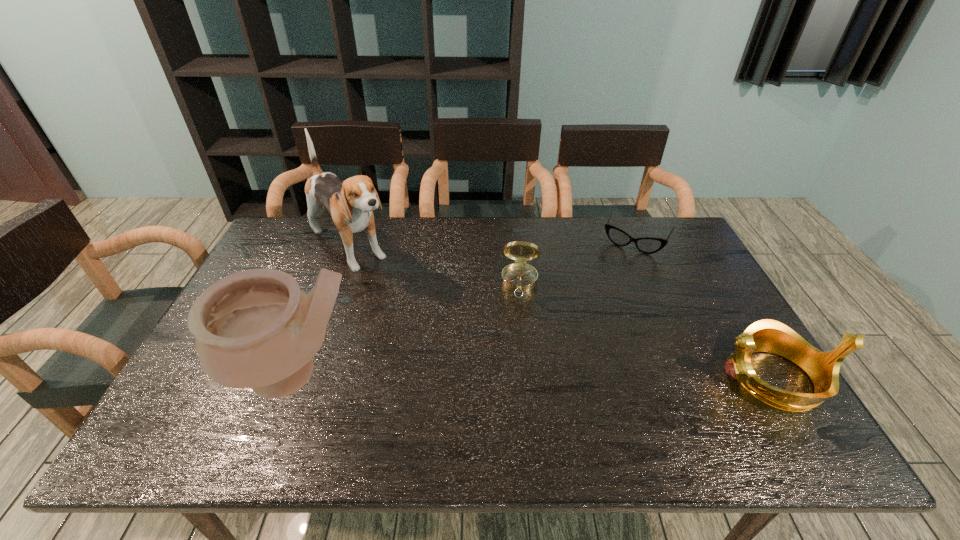
This screenshot has width=960, height=540. I want to click on pottery, so click(x=256, y=329).

This screenshot has width=960, height=540. What are the coordinates of `tiara` in the screenshot? It's located at (767, 335).

What are the coordinates of `puppy` in the screenshot? It's located at (351, 202).

Identify the location of the third object from right to left. The height and width of the screenshot is (540, 960). (519, 277).

Image resolution: width=960 pixels, height=540 pixels. In order to click on spectacles in this screenshot , I will do `click(648, 245)`.

This screenshot has width=960, height=540. I want to click on vacant space located 0.170m on the right of the pottery, so click(434, 375).

Locate an element on the screen. Image resolution: width=960 pixels, height=540 pixels. free space located 0.070m at the front emblem of the tiara is located at coordinates (687, 378).

Image resolution: width=960 pixels, height=540 pixels. Identify the location of vacant space located 0.100m at the front emblem of the tiara. (675, 378).

Identify the location of vacant region located at the front emblem of the tiara. Image resolution: width=960 pixels, height=540 pixels. (592, 378).

This screenshot has width=960, height=540. Identify the location of vacant space positioned 0.110m at the face of the puppy. (393, 291).